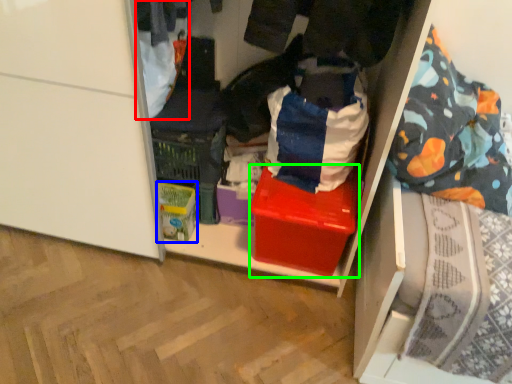
Question: Considering the real-world distances, which object is farthest from clothing (highlighted by a red box)? storage box (highlighted by a blue box) or box (highlighted by a green box)?

Choices:
 (A) storage box
 (B) box

Answer: (B)